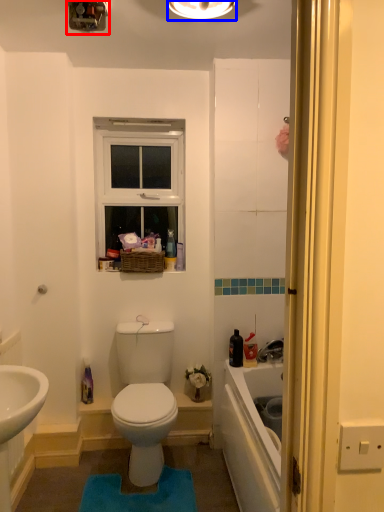
Question: Among these objects, which one is farthest to the camera, light fixture (highlighted by a red box) or light fixture (highlighted by a blue box)?

Choices:
 (A) light fixture
 (B) light fixture

Answer: (A)